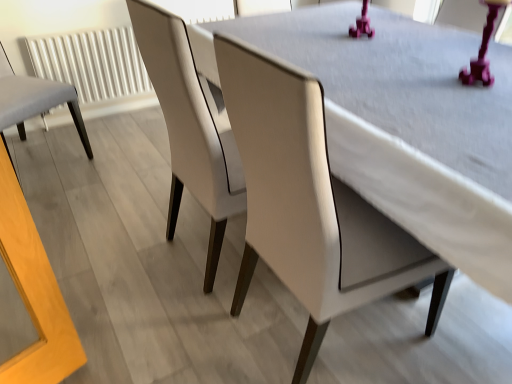
Question: From a real-world perspective, does matte white chair at center, arranged as the 2th chair when viewed from the left, stand above white leather chair at center, the 1th chair in the right-to-left sequence?

Choices:
 (A) no
 (B) yes

Answer: (B)

Question: Is matte white chair at center, arranged as the 2th chair when viewed from the left, shorter than white leather chair at center, positioned as the third chair in left-to-right order?

Choices:
 (A) no
 (B) yes

Answer: (A)

Question: Considering the relative sizes of matte white chair at center, arranged as the 2th chair when viewed from the left, and white leather chair at center, the 1th chair in the right-to-left sequence, in the image provided, is matte white chair at center, arranged as the 2th chair when viewed from the left, wider than white leather chair at center, the 1th chair in the right-to-left sequence,?

Choices:
 (A) yes
 (B) no

Answer: (B)

Question: From the image's perspective, is matte white chair at center, arranged as the 2th chair when viewed from the left, on white leather chair at center, positioned as the third chair in left-to-right order?

Choices:
 (A) yes
 (B) no

Answer: (A)

Question: Is matte white chair at center, arranged as the 2th chair when viewed from the left, closer to the viewer compared to white leather chair at center, the 1th chair in the right-to-left sequence?

Choices:
 (A) no
 (B) yes

Answer: (A)

Question: Does matte white chair at center, arranged as the 2th chair when viewed from the left, appear on the right side of white leather chair at center, positioned as the third chair in left-to-right order?

Choices:
 (A) yes
 (B) no

Answer: (B)

Question: Is white textured radiator at left at the back of white leather chair at center, positioned as the third chair in left-to-right order?

Choices:
 (A) yes
 (B) no

Answer: (B)

Question: Is white leather chair at center, the 1th chair in the right-to-left sequence, touching white textured radiator at left?

Choices:
 (A) no
 (B) yes

Answer: (A)

Question: Can you confirm if white leather chair at center, positioned as the third chair in left-to-right order, is thinner than white textured radiator at left?

Choices:
 (A) no
 (B) yes

Answer: (A)

Question: From the image's perspective, does white leather chair at center, positioned as the third chair in left-to-right order, appear lower than white textured radiator at left?

Choices:
 (A) yes
 (B) no

Answer: (A)

Question: Are white leather chair at center, the 1th chair in the right-to-left sequence, and white textured radiator at left far apart?

Choices:
 (A) no
 (B) yes

Answer: (B)

Question: From a real-world perspective, is white leather chair at center, the 1th chair in the right-to-left sequence, beneath white textured radiator at left?

Choices:
 (A) yes
 (B) no

Answer: (B)

Question: From the image's perspective, does white textured radiator at left appear lower than light gray fabric chair at left, which appears as the third chair when viewed from the right?

Choices:
 (A) yes
 (B) no

Answer: (B)